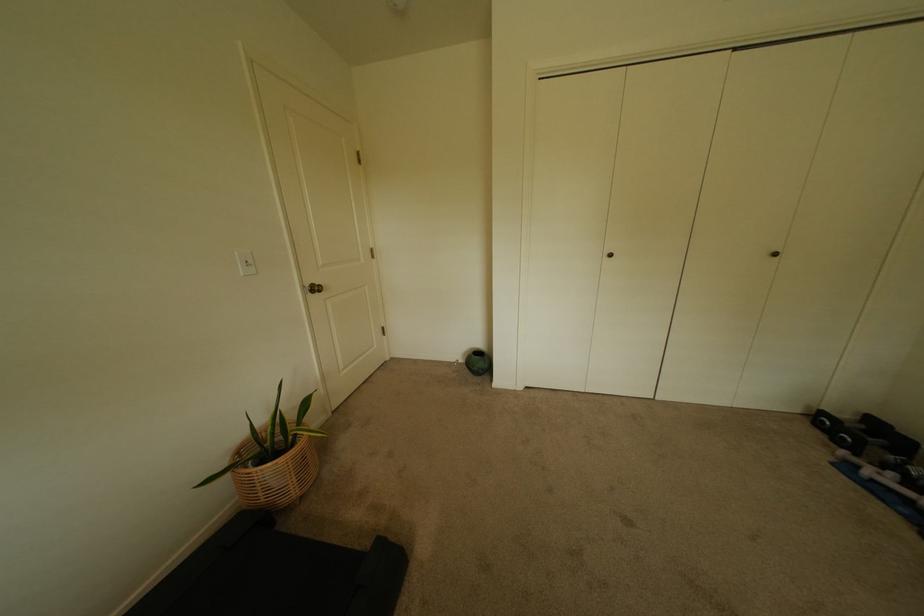
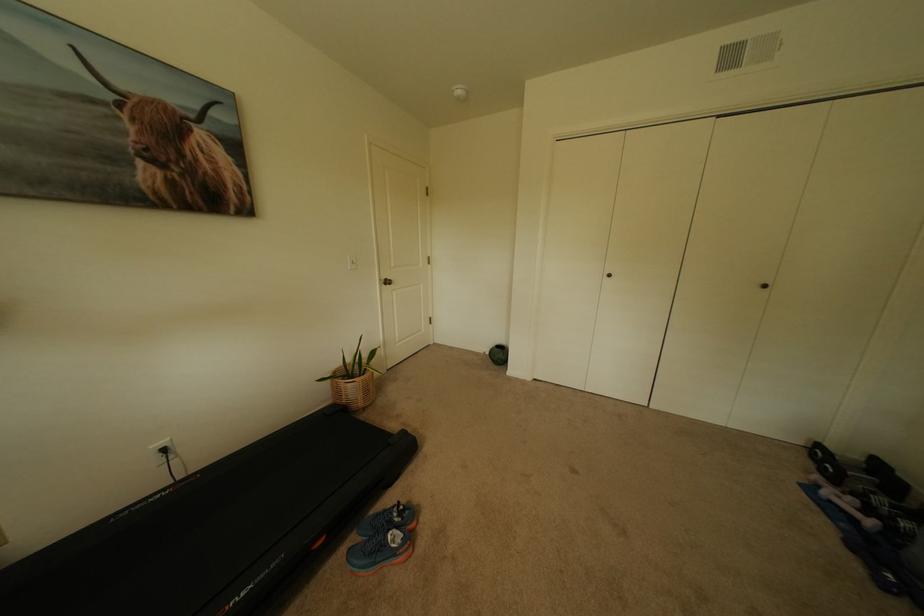
Where in the second image is the point corresponding to point 302,480 from the first image?

(370, 395)